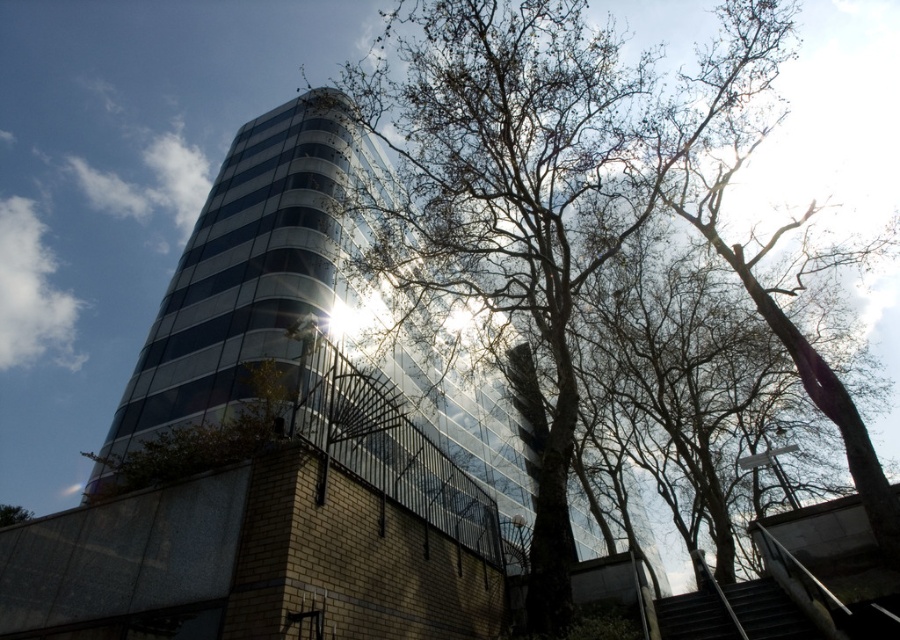
Is point (410, 61) farther from viewer compared to point (760, 616)?

Yes.

Between bare branches at center and dark gray metal stairs at lower right, which one is positioned higher?

bare branches at center is higher up.

Identify the location of bare branches at center. The width and height of the screenshot is (900, 640). (569, 195).

The height and width of the screenshot is (640, 900). In order to click on bare branches at center in this screenshot , I will do `click(569, 195)`.